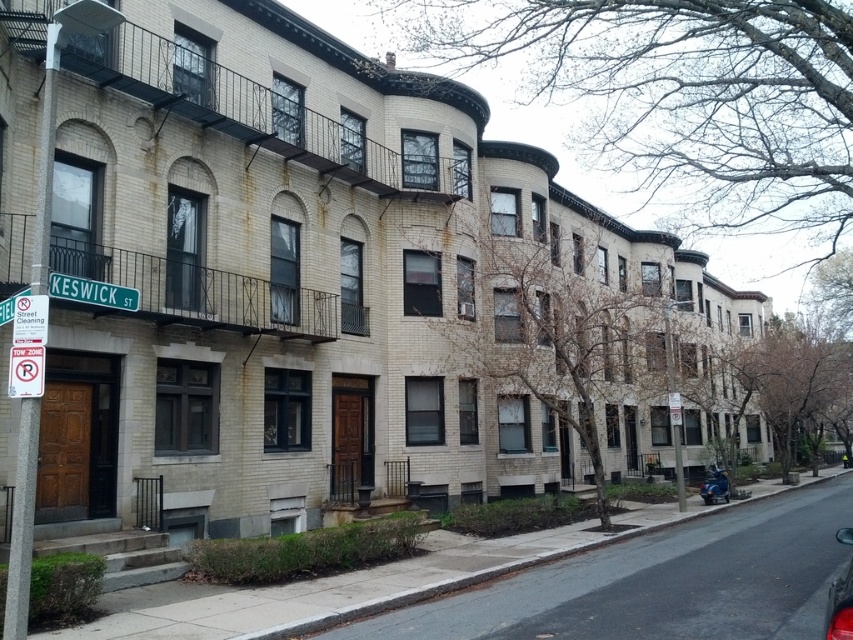
Is green metal street sign at upper left taller than red plastic sign at lower left?

Incorrect, green metal street sign at upper left's height is not larger of red plastic sign at lower left's.

From the picture: Can you confirm if green metal street sign at upper left is wider than red plastic sign at lower left?

Yes, green metal street sign at upper left is wider than red plastic sign at lower left.

Who is more distant from viewer, [125,300] or [7,387]?

Positioned behind is point [7,387].

You are a GUI agent. You are given a task and a screenshot of the screen. Output one action in this format:
    pyautogui.click(x=<x>, y=<y>)
    Task: Click on the green metal street sign at upper left
    Image resolution: width=853 pixels, height=640 pixels.
    Given the screenshot: What is the action you would take?
    pyautogui.click(x=91, y=291)

Does shiny red car at lower right appear on the left side of metallic blue scooter at lower right?

Yes, shiny red car at lower right is to the left of metallic blue scooter at lower right.

Is shiny red car at lower right wider than metallic blue scooter at lower right?

Yes.

Is point (845, 570) in front of point (709, 486)?

That is True.

At what (x,y) coordinates should I click in order to perform the action: click on shiny red car at lower right. Please return your answer as a coordinate pair (x, y). The height and width of the screenshot is (640, 853). Looking at the image, I should click on (840, 605).

Is gray concrete curb at lower center thinner than shiny red car at lower right?

No, gray concrete curb at lower center is not thinner than shiny red car at lower right.

Can you confirm if gray concrete curb at lower center is positioned above shiny red car at lower right?

No, gray concrete curb at lower center is not above shiny red car at lower right.

Measure the distance between point (314, 604) and camera.

A distance of 9.50 meters exists between point (314, 604) and camera.

The width and height of the screenshot is (853, 640). What are the coordinates of `gray concrete curb at lower center` in the screenshot? It's located at (548, 568).